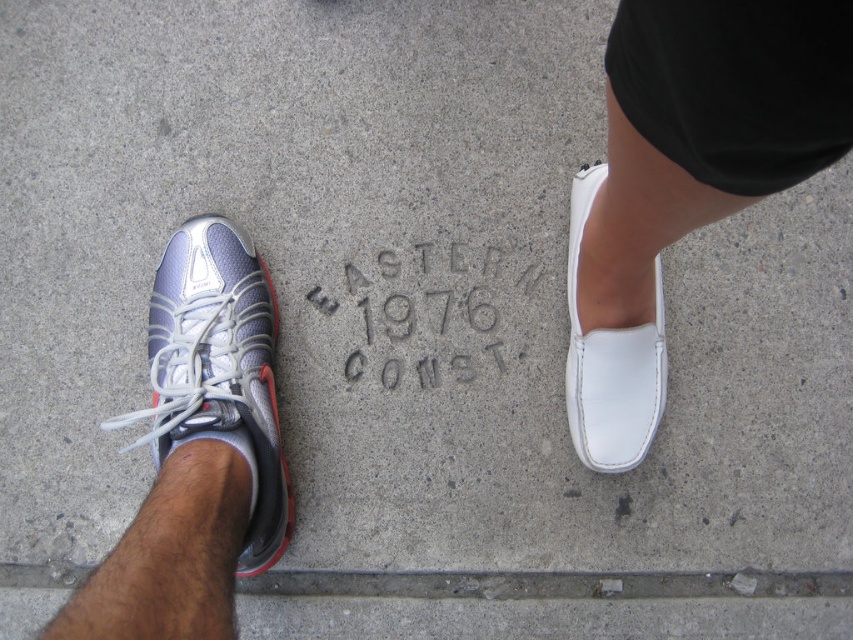
Does white leather shoe at right have a greater width compared to silver mesh sneaker at left?

No.

Does white leather shoe at right have a smaller size compared to silver mesh sneaker at left?

No, white leather shoe at right is not smaller than silver mesh sneaker at left.

Where is `white leather shoe at right`? This screenshot has width=853, height=640. white leather shoe at right is located at coordinates (686, 179).

Identify the location of white leather shoe at right. The height and width of the screenshot is (640, 853). (686, 179).

Which is behind, point (672, 220) or point (593, 189)?

Point (593, 189)

Image resolution: width=853 pixels, height=640 pixels. Find the location of `white leather shoe at right`. white leather shoe at right is located at coordinates point(686,179).

This screenshot has width=853, height=640. I want to click on white leather shoe at right, so click(686, 179).

Who is higher up, silver mesh sneaker at left or white leather loafer at right?

white leather loafer at right is above.

Does silver mesh sneaker at left have a greater height compared to white leather loafer at right?

Indeed, silver mesh sneaker at left has a greater height compared to white leather loafer at right.

This screenshot has width=853, height=640. I want to click on silver mesh sneaker at left, so click(x=219, y=369).